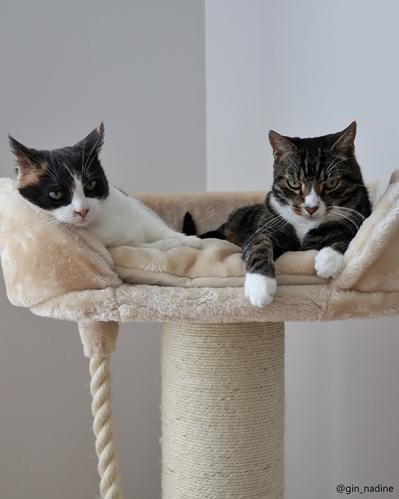
Locate an element on the screen. white wall is located at coordinates (157, 117), (251, 122).